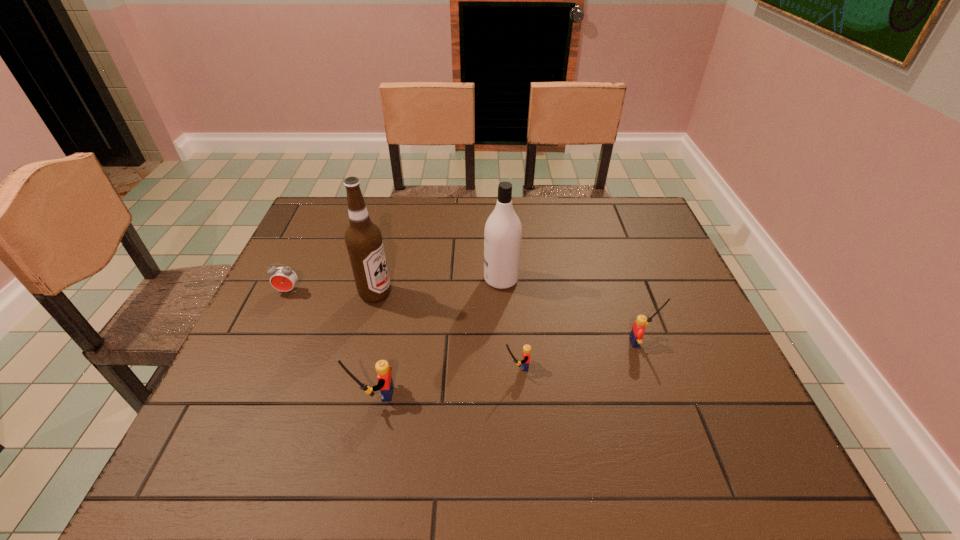
Identify the location of vacant space in between the shortest Lego and the tallest Lego. Image resolution: width=960 pixels, height=540 pixels. (445, 381).

This screenshot has width=960, height=540. What are the coordinates of `free spot between the nearest Lego and the shortest Lego` in the screenshot? It's located at (445, 381).

Find the location of `unoccupied area between the nearest Lego and the rightmost Lego`. unoccupied area between the nearest Lego and the rightmost Lego is located at coordinates (x=510, y=368).

What are the coordinates of `unoccupied position between the second Lego from left to right and the alcohol` in the screenshot? It's located at (446, 330).

You are a GUI agent. You are given a task and a screenshot of the screen. Output one action in this format:
    pyautogui.click(x=<x>, y=<y>)
    Task: Click on the blank region between the alcohol and the second tallest object
    
    Given the screenshot: What is the action you would take?
    pyautogui.click(x=439, y=287)

Where is `unoccupied area between the alarm clock and the shortest Lego`? unoccupied area between the alarm clock and the shortest Lego is located at coordinates (402, 329).

Where is `free area in between the nearest Lego and the alarm clock`? This screenshot has width=960, height=540. free area in between the nearest Lego and the alarm clock is located at coordinates (331, 342).

What are the coordinates of `free space between the alcohol and the nearest Lego` in the screenshot? It's located at (375, 344).

This screenshot has height=540, width=960. In order to click on free area in between the second shortest Lego and the nearest object in this screenshot , I will do click(510, 368).

Select which object appears as the closest to the second Lego from left to right. Please provide its 2D coordinates. Your answer should be formatted as a tuple, i.e. [(x, y)], where the tuple contains the x and y coordinates of a point satisfying the conditions above.

[(503, 231)]